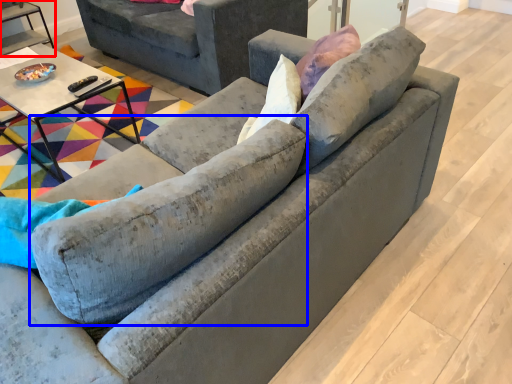
Question: Which point is closer to the camera, table (highlighted by a red box) or swivel chair (highlighted by a blue box)?

Choices:
 (A) table
 (B) swivel chair

Answer: (B)